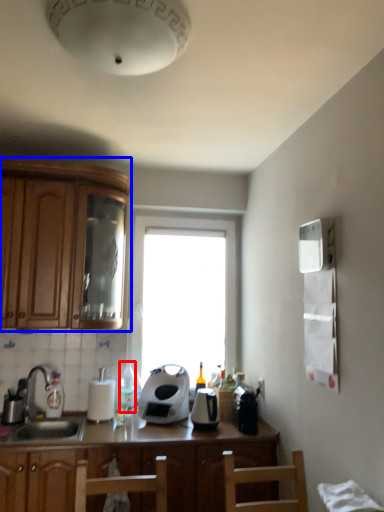
Question: Which of the following is the farthest to the observer, bottle (highlighted by a red box) or cabinetry (highlighted by a blue box)?

Choices:
 (A) bottle
 (B) cabinetry

Answer: (A)